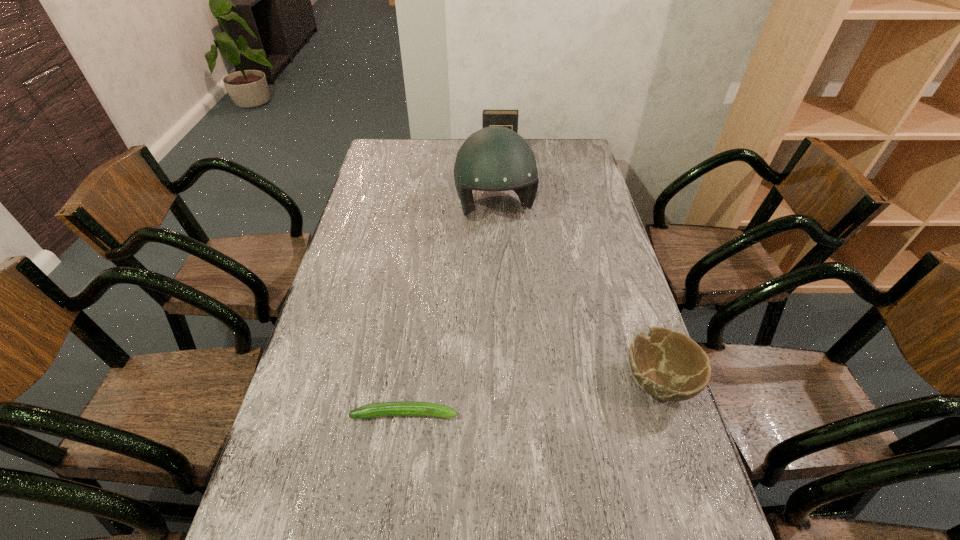
Where is `vacant space located 0.340m at the face opening of the tallest object`? The height and width of the screenshot is (540, 960). vacant space located 0.340m at the face opening of the tallest object is located at coordinates (527, 312).

Locate an element on the screen. Image resolution: width=960 pixels, height=540 pixels. vacant space situated at the face opening of the tallest object is located at coordinates (527, 312).

I want to click on vacant space located on the front cover of the diary, so click(x=500, y=187).

Locate an element on the screen. free location located 0.230m on the front cover of the diary is located at coordinates (500, 187).

Identify the location of free location located 0.240m on the front cover of the diary. The height and width of the screenshot is (540, 960). (500, 188).

Identify the location of object positioned at the far edge. The image size is (960, 540). (505, 118).

This screenshot has height=540, width=960. In order to click on object that is at the left edge in this screenshot , I will do `click(399, 408)`.

Where is `object that is at the right edge`? The image size is (960, 540). object that is at the right edge is located at coordinates (667, 364).

In the image, there is a desktop. At what (x,y) coordinates should I click in order to perform the action: click on vacant space at the far edge. Please return your answer as a coordinate pair (x, y). This screenshot has width=960, height=540. Looking at the image, I should click on (549, 165).

The height and width of the screenshot is (540, 960). I want to click on free space at the left edge of the desktop, so click(306, 378).